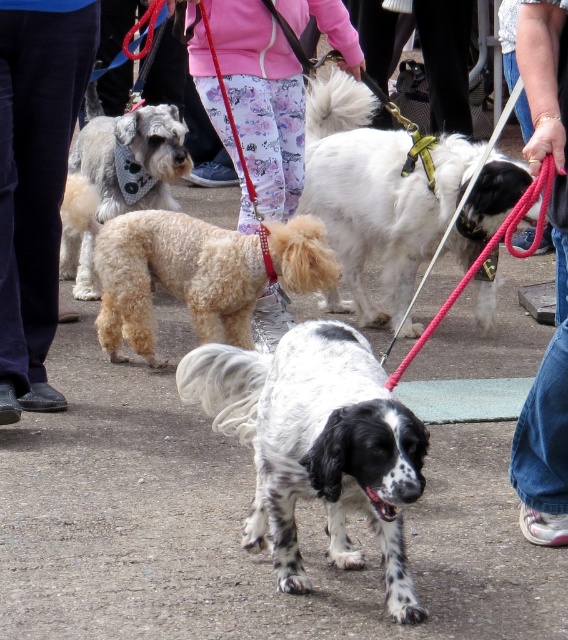
Question: Is speckled fur dog at center wider than fluffy beige dog at lower left?

Choices:
 (A) yes
 (B) no

Answer: (A)

Question: Can you confirm if fuzzy beige dog at center is thinner than fluffy white dog at center?

Choices:
 (A) yes
 (B) no

Answer: (B)

Question: Which is farther from the fluffy beige dog at lower left?

Choices:
 (A) fluffy white dog at center
 (B) rope leash at center

Answer: (B)

Question: Which point is farther from the camera taking this photo?

Choices:
 (A) (164, 141)
 (B) (511, 218)
 (C) (27, 376)
 (D) (195, 86)

Answer: (A)

Question: Does white fluffy dog at center have a larger size compared to rope leash at center?

Choices:
 (A) no
 (B) yes

Answer: (B)

Question: Which point is farther from the camera taking this photo?

Choices:
 (A) pos(552,97)
 (B) pos(223,124)

Answer: (B)